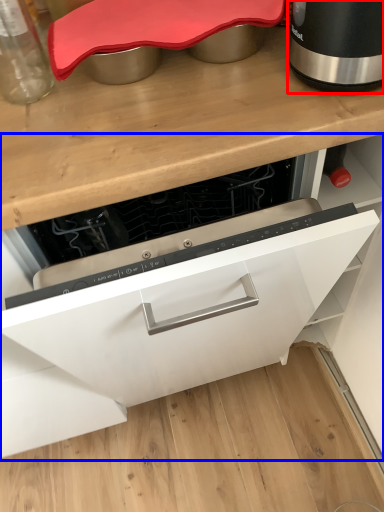
Question: Which object is closer to the camera taking this photo, home appliance (highlighted by a red box) or cabinetry (highlighted by a blue box)?

Choices:
 (A) home appliance
 (B) cabinetry

Answer: (B)